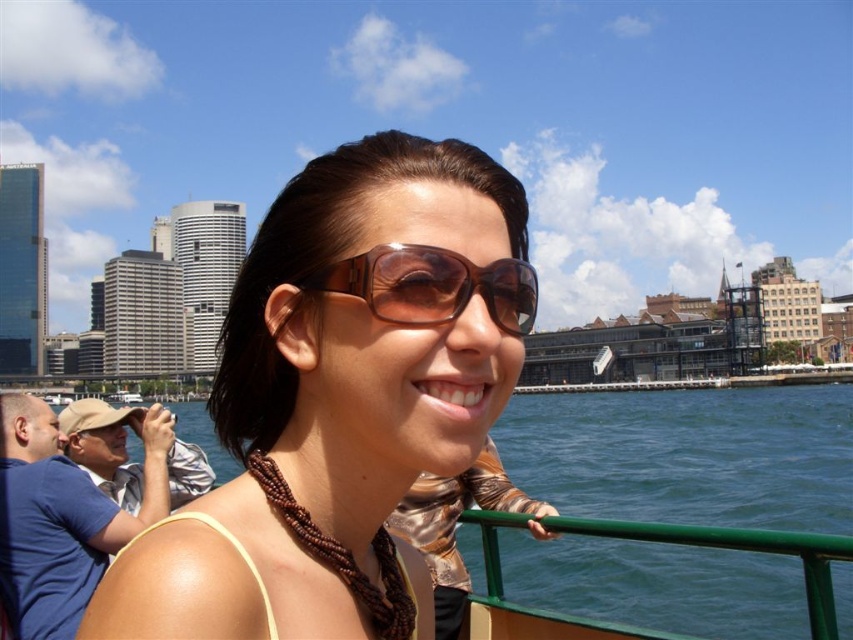
Between brown leather sunglasses at center and brown shiny sunglasses at center, which one is positioned higher?

brown shiny sunglasses at center

Can you confirm if brown leather sunglasses at center is wider than brown shiny sunglasses at center?

Indeed, brown leather sunglasses at center has a greater width compared to brown shiny sunglasses at center.

Does point (439, 356) lie in front of point (437, 316)?

No, it is not.

You are a GUI agent. You are given a task and a screenshot of the screen. Output one action in this format:
    pyautogui.click(x=<x>, y=<y>)
    Task: Click on the brown leather sunglasses at center
    This screenshot has width=853, height=640.
    Given the screenshot: What is the action you would take?
    coord(364,369)

Between point (293, 572) and point (755, 516), which one is positioned behind?

The point (755, 516) is behind.

Measure the distance from brown leather sunglasses at center to blue water at lower right.

They are 119.93 feet apart.

Where is `brown leather sunglasses at center`? This screenshot has width=853, height=640. brown leather sunglasses at center is located at coordinates (364, 369).

Is blue water at lower right bigger than brown shiny sunglasses at center?

Yes, blue water at lower right is bigger than brown shiny sunglasses at center.

I want to click on blue water at lower right, so click(665, 509).

Which is behind, point (560, 596) or point (461, 259)?

Positioned behind is point (560, 596).

Locate an element on the screen. This screenshot has height=640, width=853. blue water at lower right is located at coordinates (665, 509).